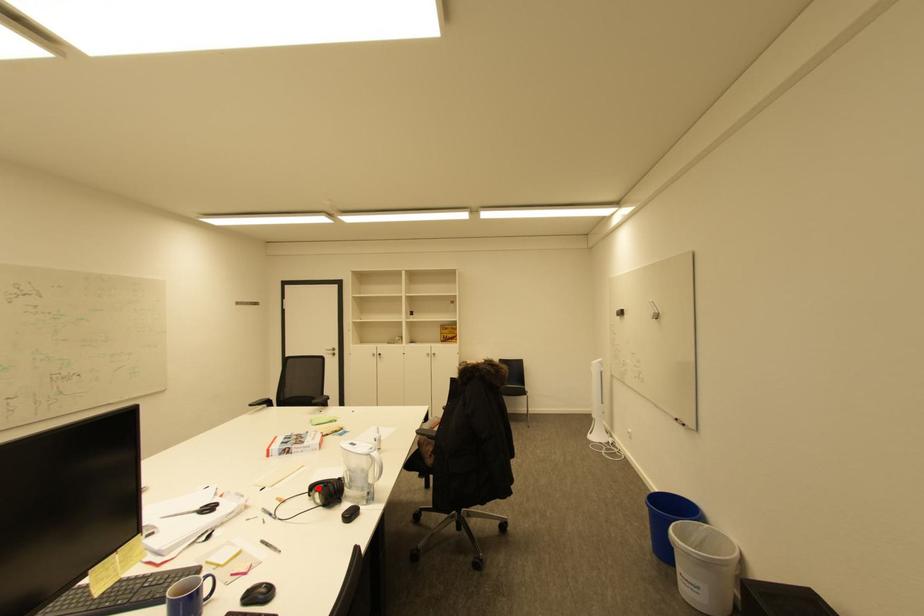
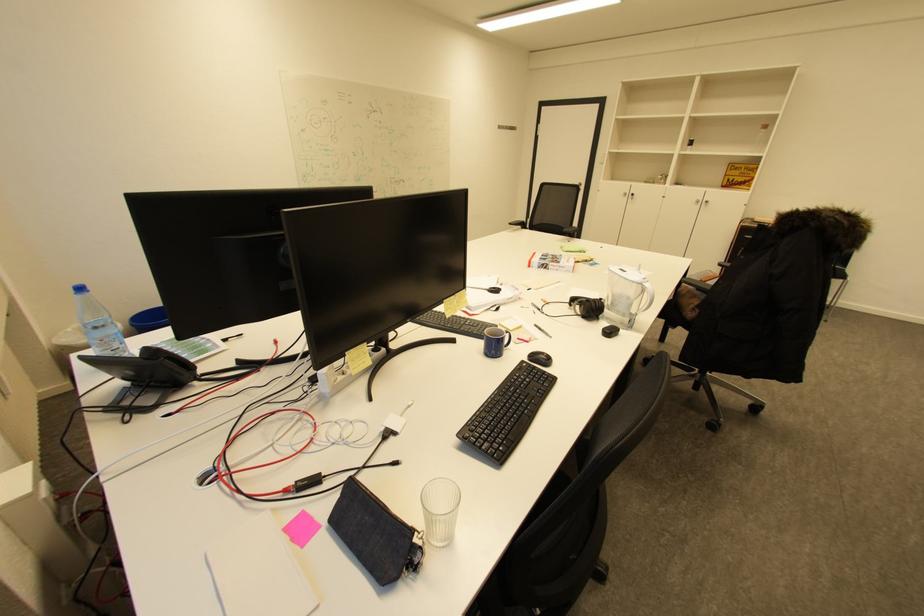
In the second image, find the point that corresponds to the highlighted location in the first image.

(579, 300)